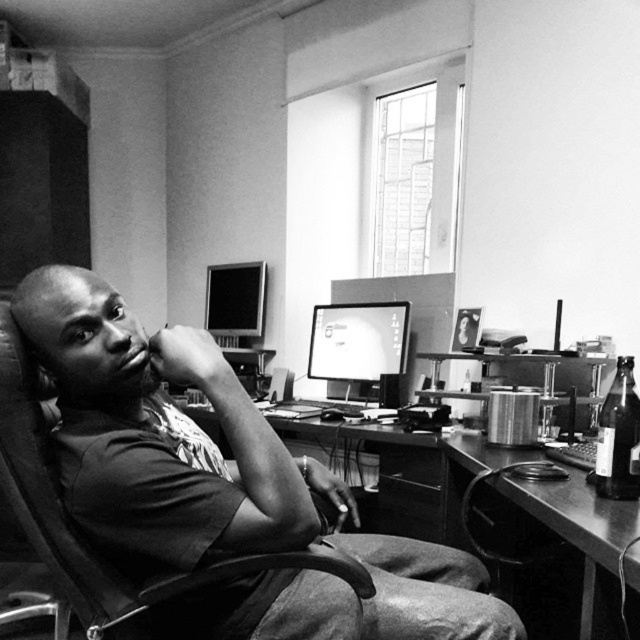
Which is more to the right, metallic desk at lower right or matte plastic monitor at center?

Positioned to the right is metallic desk at lower right.

Is point (524, 497) closer to viewer compared to point (385, 339)?

Yes, point (524, 497) is in front of point (385, 339).

What are the coordinates of `metallic desk at lower right` in the screenshot? It's located at (579, 525).

The width and height of the screenshot is (640, 640). What are the coordinates of `metallic desk at lower right` in the screenshot? It's located at (579, 525).

From the picture: Is translucent glass bottle at right shorter than matte black monitor at upper center?

Yes.

Which is in front, point (618, 426) or point (259, 304)?

Point (618, 426) is more forward.

The height and width of the screenshot is (640, 640). What are the coordinates of `translucent glass bottle at right` in the screenshot? It's located at (618, 436).

Consider the image. Between matte plastic monitor at center and matte black monitor at upper center, which one has less height?

With less height is matte plastic monitor at center.

Does matte plastic monitor at center have a smaller size compared to matte black monitor at upper center?

No, matte plastic monitor at center is not smaller than matte black monitor at upper center.

Does point (392, 305) lie behind point (221, 340)?

No.

Locate an element on the screen. matte plastic monitor at center is located at coordinates (358, 340).